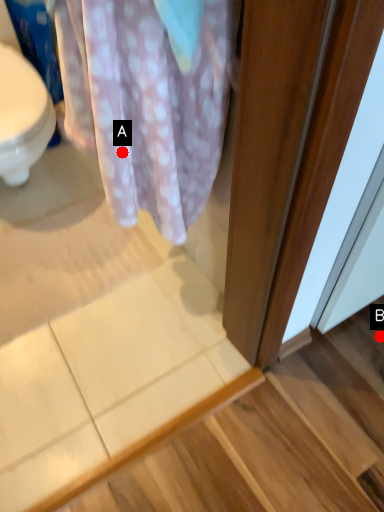
Question: Two points are circled on the image, labeled by A and B beside each circle. Which point is closer to the camera?

Choices:
 (A) A is closer
 (B) B is closer

Answer: (A)